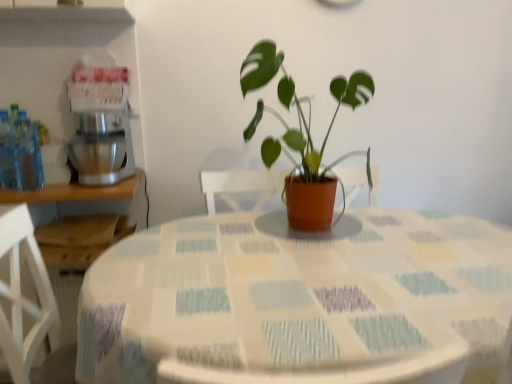
Question: Can you confirm if matte terracotta pot at center is shorter than silver metallic mixer at left?

Choices:
 (A) no
 (B) yes

Answer: (A)

Question: Can you confirm if matte terracotta pot at center is wider than silver metallic mixer at left?

Choices:
 (A) yes
 (B) no

Answer: (A)

Question: Is matte terracotta pot at center oriented towards silver metallic mixer at left?

Choices:
 (A) yes
 (B) no

Answer: (B)

Question: Is matte terracotta pot at center completely or partially outside of silver metallic mixer at left?

Choices:
 (A) yes
 (B) no

Answer: (A)

Question: From a real-world perspective, is matte terracotta pot at center under silver metallic mixer at left?

Choices:
 (A) yes
 (B) no

Answer: (B)

Question: Does point (351, 86) appear closer or farther from the camera than point (359, 284)?

Choices:
 (A) closer
 (B) farther

Answer: (B)

Question: Based on their positions, is matte terracotta pot at center located to the left or right of textured fabric tablecloth at center?

Choices:
 (A) left
 (B) right

Answer: (A)

Question: In terms of width, does matte terracotta pot at center look wider or thinner when compared to textured fabric tablecloth at center?

Choices:
 (A) wide
 (B) thin

Answer: (B)

Question: Considering their positions, is matte terracotta pot at center located in front of or behind textured fabric tablecloth at center?

Choices:
 (A) front
 (B) behind

Answer: (B)

Question: From a real-world perspective, is textured fabric tablecloth at center above or below matte terracotta pot at center?

Choices:
 (A) above
 (B) below

Answer: (B)

Question: Is textured fabric tablecloth at center situated inside matte terracotta pot at center or outside?

Choices:
 (A) inside
 (B) outside

Answer: (B)

Question: Relative to matte terracotta pot at center, is textured fabric tablecloth at center in front or behind?

Choices:
 (A) behind
 (B) front

Answer: (B)

Question: Does point (100, 264) appear closer or farther from the camera than point (325, 170)?

Choices:
 (A) closer
 (B) farther

Answer: (A)

Question: Considering the positions of textured fabric tablecloth at center and silver metallic mixer at left in the image, is textured fabric tablecloth at center bigger or smaller than silver metallic mixer at left?

Choices:
 (A) small
 (B) big

Answer: (B)

Question: Is point (177, 233) positioned closer to the camera than point (114, 129)?

Choices:
 (A) closer
 (B) farther

Answer: (A)